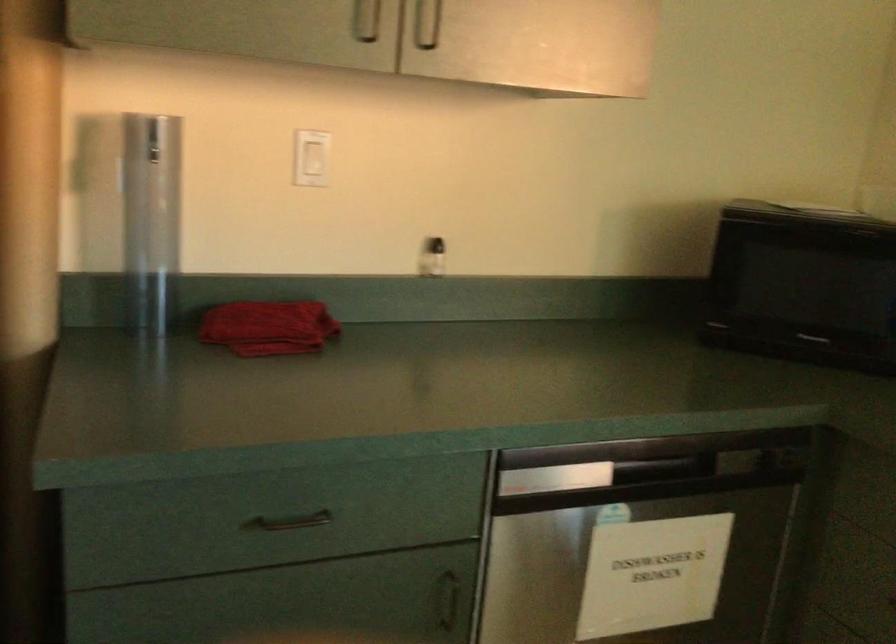
Question: The images are taken continuously from a first-person perspective. In which direction is your viewpoint rotating?

Choices:
 (A) Left
 (B) Right
 (C) Up
 (D) Down

Answer: (A)